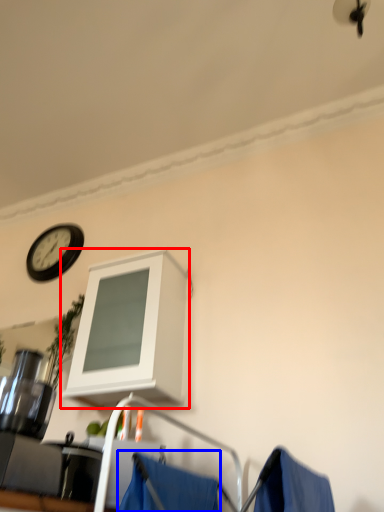
Question: Which point is further to the camera, cabinetry (highlighted by a red box) or curtain (highlighted by a blue box)?

Choices:
 (A) cabinetry
 (B) curtain

Answer: (A)